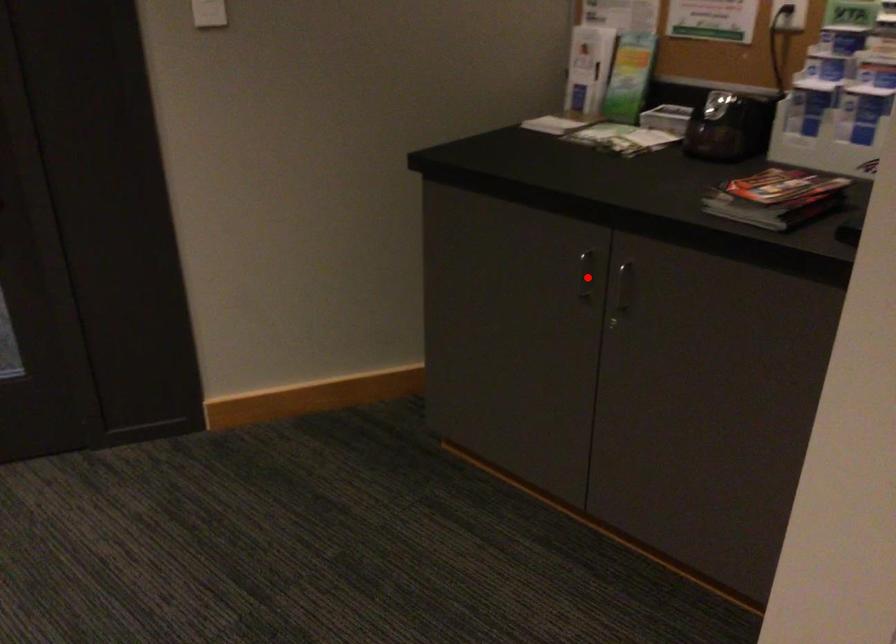
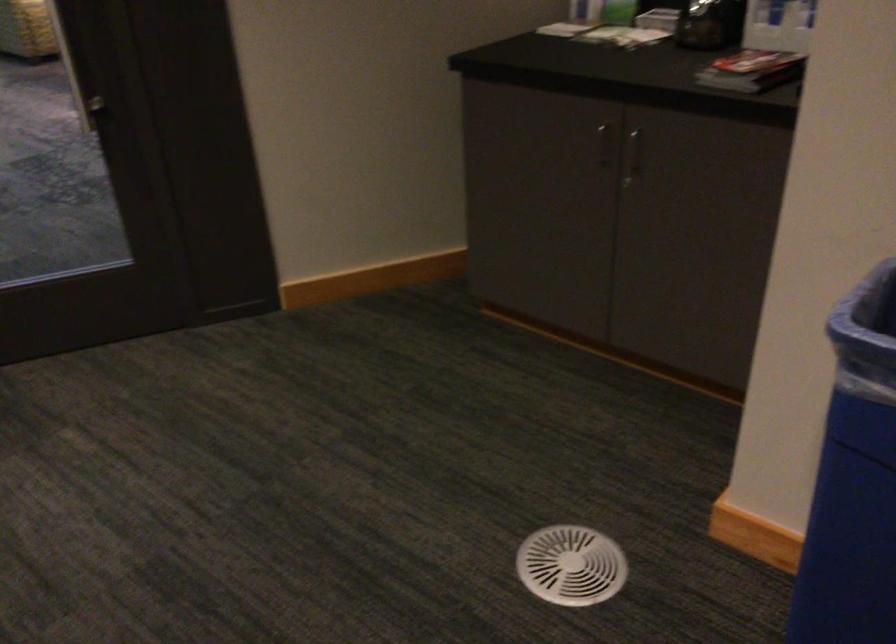
Question: I am providing you with two images of the same scene from different viewpoints. In image1, a red point is highlighted. Considering the same 3D point in image2, which of the following is correct?

Choices:
 (A) It is closer
 (B) It is farther

Answer: (B)